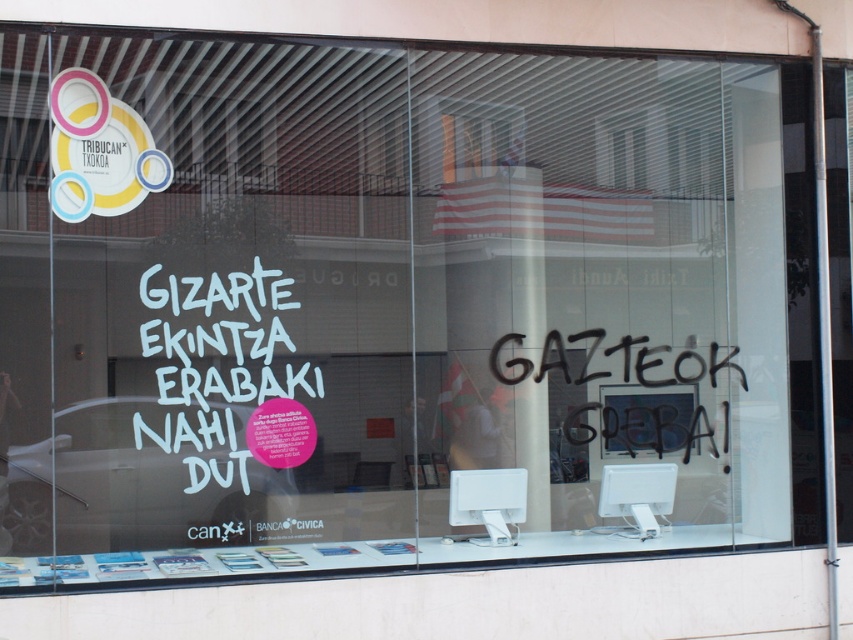
Question: Which object appears closest to the camera in this image?

Choices:
 (A) white vinyl text at center
 (B) black spray paint at center

Answer: (A)

Question: Among these objects, which one is nearest to the camera?

Choices:
 (A) black spray paint at center
 (B) white vinyl text at center

Answer: (B)

Question: Where is white vinyl text at center located in relation to black spray paint at center in the image?

Choices:
 (A) below
 (B) above

Answer: (B)

Question: Can you confirm if white vinyl text at center is positioned below black spray paint at center?

Choices:
 (A) yes
 (B) no

Answer: (B)

Question: Is white vinyl text at center thinner than black spray paint at center?

Choices:
 (A) yes
 (B) no

Answer: (A)